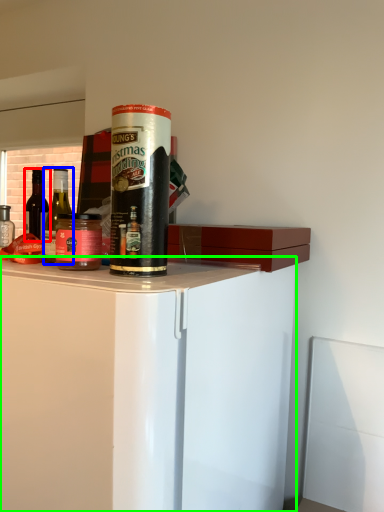
Question: Which is farther away from bottle (highlighted by a red box)? bottle (highlighted by a blue box) or cabinetry (highlighted by a green box)?

Choices:
 (A) bottle
 (B) cabinetry

Answer: (A)